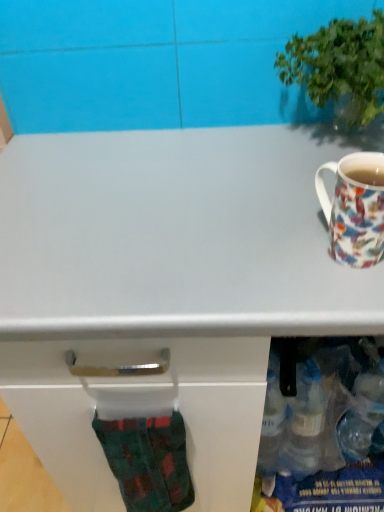
Where is `free spot to the left of porcelain floral mug at right`? The width and height of the screenshot is (384, 512). free spot to the left of porcelain floral mug at right is located at coordinates click(230, 251).